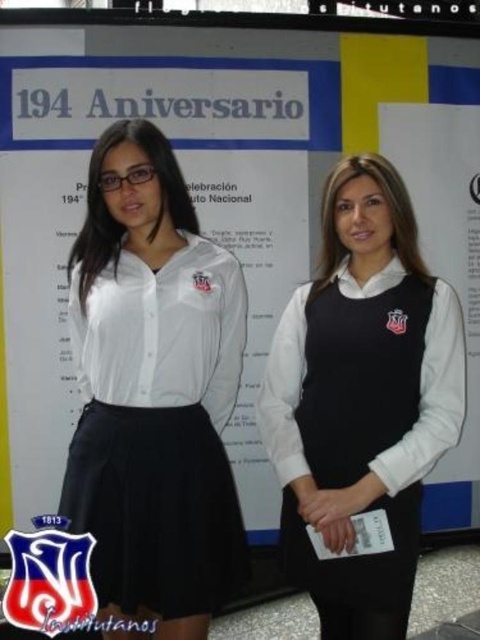
You are at an event celebrating the 194th anniversary of an organization. You see a white matte shirt at center and a black matte vest at center. Which one is positioned more to the left?

The white matte shirt at center is positioned more to the left than the black matte vest at center.

You are at the event celebrating the 194th anniversary. You need to locate the person wearing the white matte shirt at center. Where exactly is this person positioned in the image?

The white matte shirt at center is located at point (154, 390).

You are taking a photo of the two people in front of the backdrop. You want to focus on the person on the left first. Which of the two points, point (86, 241) or point (354, 586), is closer to the camera?

Point (86, 241) is closer to the camera than point (354, 586).